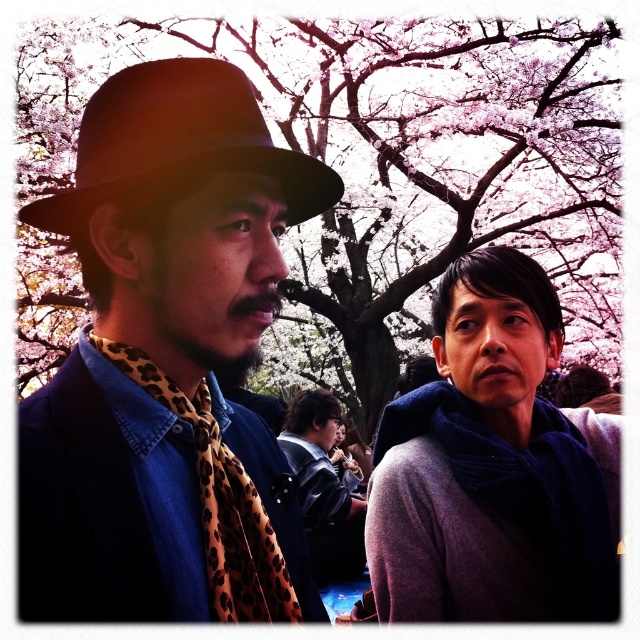
Is black felt fedora at left above leopard print scarf at left?

Yes.

Where is `black felt fedora at left`? Image resolution: width=640 pixels, height=640 pixels. black felt fedora at left is located at coordinates (177, 141).

Identify the location of black felt fedora at left. [x=177, y=141].

Is point (500, 189) closer to viewer compared to point (280, 433)?

No, (500, 189) is behind (280, 433).

Who is shorter, pink blossom tree at upper center or leopard print scarf at center?

leopard print scarf at center is shorter.

Does point (589, 131) come farther from viewer compared to point (317, 451)?

Yes, it is.

The height and width of the screenshot is (640, 640). I want to click on pink blossom tree at upper center, so click(x=390, y=164).

Is point (120, 104) positioned behind point (307, 492)?

No.

Is point (145, 124) closer to viewer compared to point (298, 472)?

Yes, point (145, 124) is closer to viewer.

Find the location of a particular element. Image resolution: width=640 pixels, height=640 pixels. black felt fedora at left is located at coordinates (177, 141).